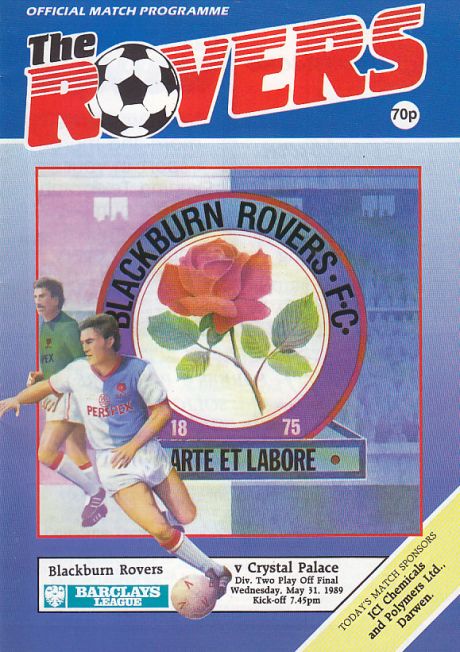
The image size is (460, 652). I want to click on 1 flower, so click(222, 280).